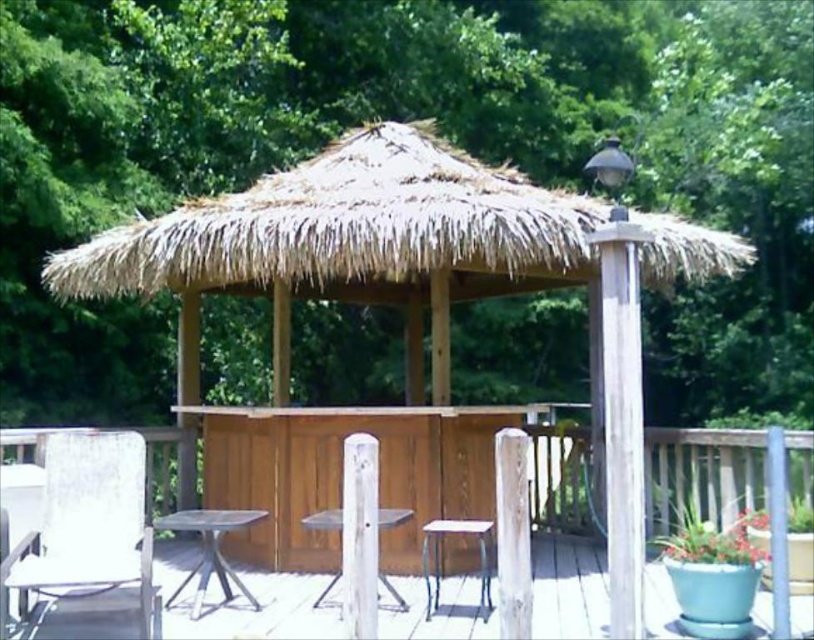
Who is lower down, natural thatched roof hut at center or wooden deck at center?

wooden deck at center is lower down.

Which is in front, point (407, 273) or point (653, 536)?

Point (653, 536) is in front.

Who is more forward, (x=300, y=193) or (x=584, y=438)?

Point (x=300, y=193) is in front.

Where is `natural thatched roof hut at center`? natural thatched roof hut at center is located at coordinates (348, 243).

Is green leafy tree at upper center taller than white plastic chair at lower left?

Yes.

Does green leafy tree at upper center have a greater width compared to white plastic chair at lower left?

Indeed, green leafy tree at upper center has a greater width compared to white plastic chair at lower left.

Does point (209, 4) come closer to viewer compared to point (94, 592)?

No.

Where is `green leafy tree at upper center`? The height and width of the screenshot is (640, 814). green leafy tree at upper center is located at coordinates (405, 120).

At what (x,y) coordinates should I click in order to perform the action: click on metallic silver stool at lower center. Please return your answer as a coordinate pair (x, y). Looking at the image, I should click on (441, 561).

Who is positioned more to the left, metallic silver stool at lower center or wooden table at center?

wooden table at center is more to the left.

Who is more forward, (488,609) or (338,529)?

Point (338,529)

Find the location of a particular element. This screenshot has width=814, height=640. metallic silver stool at lower center is located at coordinates (441, 561).